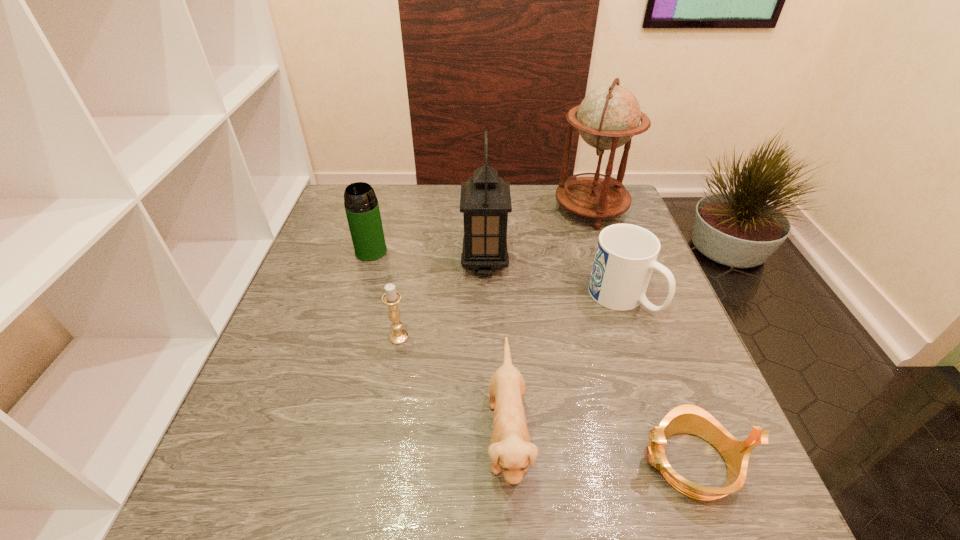
Find the location of a particular element. The height and width of the screenshot is (540, 960). object that is at the near right corner is located at coordinates (687, 418).

This screenshot has width=960, height=540. I want to click on vacant area at the far edge of the desktop, so click(388, 214).

Identify the location of vacant space at the near edge of the desktop. (394, 496).

Locate an element on the screen. This screenshot has width=960, height=540. vacant point at the left edge is located at coordinates (356, 296).

Identify the location of free space at the right edge of the desktop. (626, 322).

In order to click on vacant area at the far left corner of the desktop in this screenshot , I will do `click(384, 197)`.

Where is `free point at the near left corner`? free point at the near left corner is located at coordinates (219, 505).

Identify the location of free area in between the farthest object and the lantern. (538, 237).

Where is `vacant space that's between the mug and the puppy`? The height and width of the screenshot is (540, 960). vacant space that's between the mug and the puppy is located at coordinates (564, 367).

The width and height of the screenshot is (960, 540). Identify the location of unoccupied position between the farthest object and the shortest object. (640, 336).